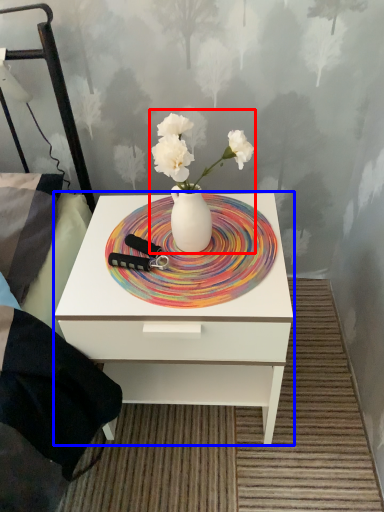
Question: Which of the following is the farthest to the observer, floral arrangement (highlighted by a red box) or nightstand (highlighted by a blue box)?

Choices:
 (A) floral arrangement
 (B) nightstand

Answer: (B)